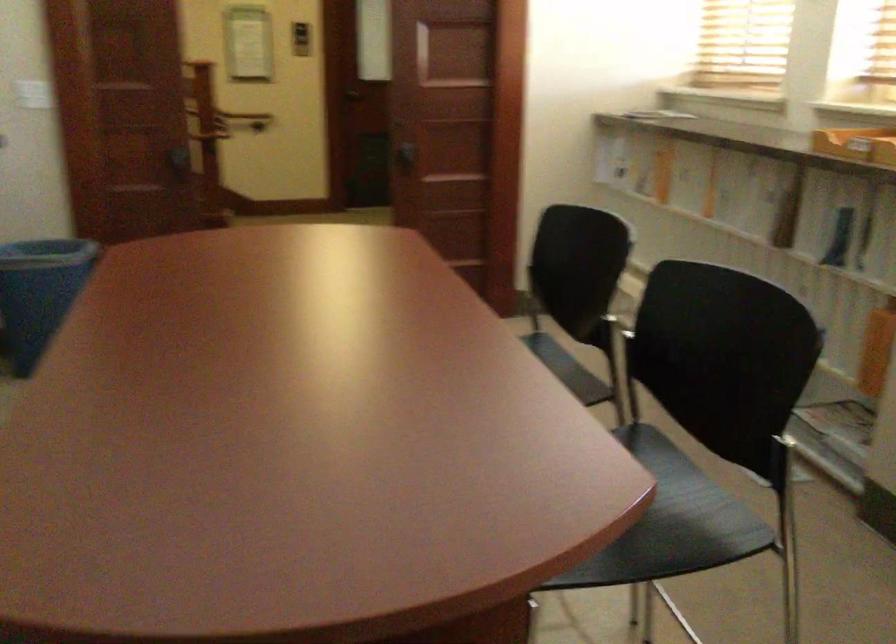
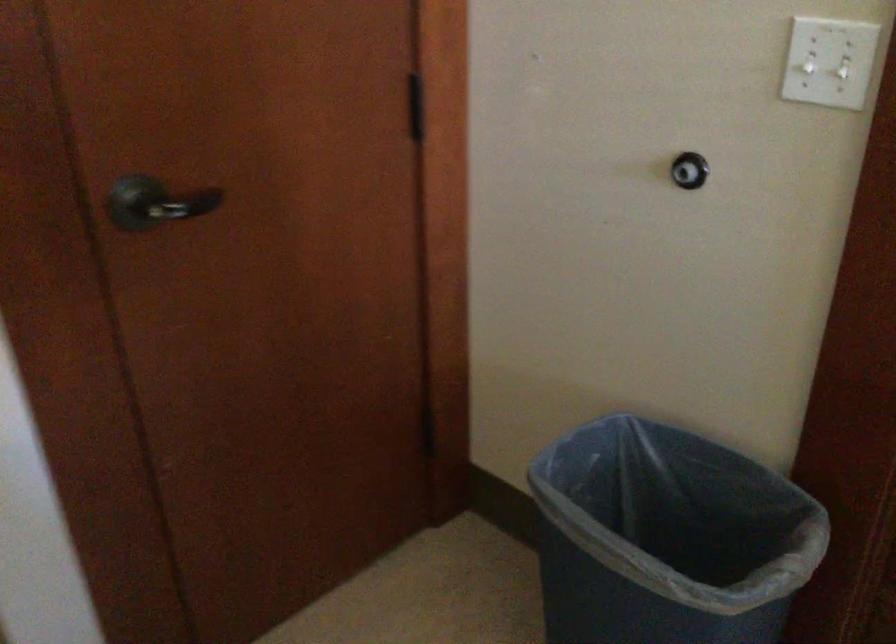
Find the pixel in the second image that matches pixel 75 274 in the first image.

(667, 538)